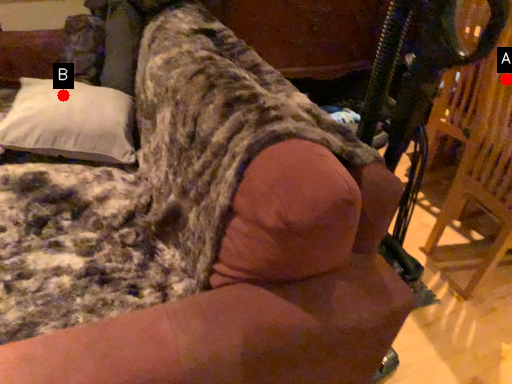
Question: Two points are circled on the image, labeled by A and B beside each circle. Which point is closer to the camera?

Choices:
 (A) A is closer
 (B) B is closer

Answer: (A)